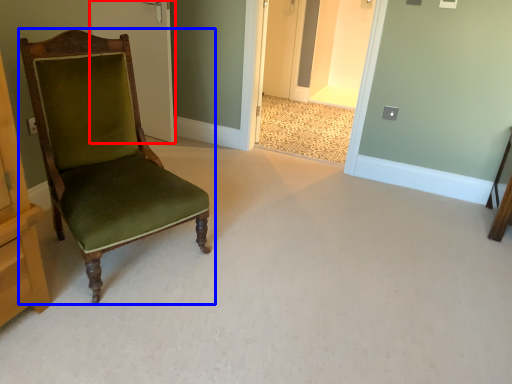
Question: Which of the following is the farthest to the observer, door (highlighted by a red box) or chair (highlighted by a blue box)?

Choices:
 (A) door
 (B) chair

Answer: (A)